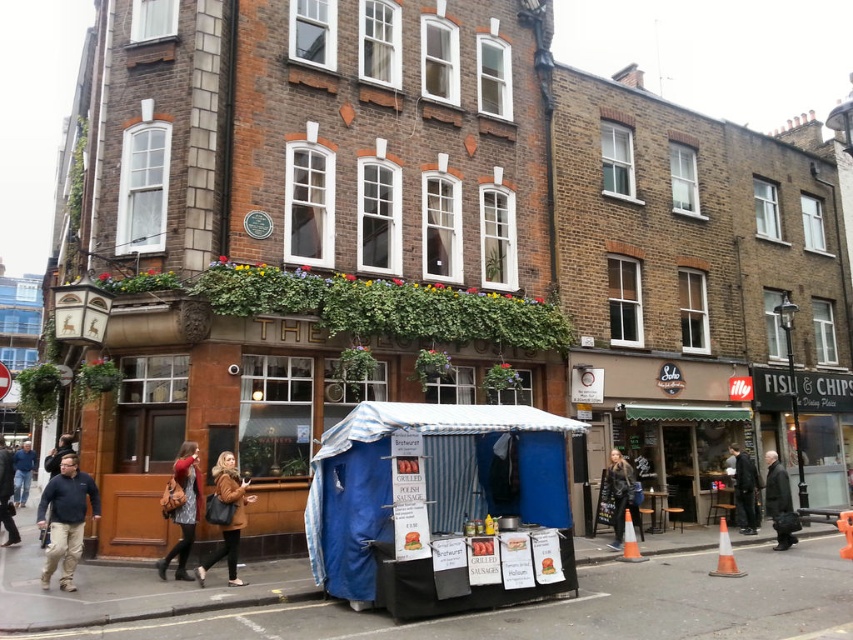
You are a customer waiting in line at the food stall. You notice two items in the scene. One is a brown fuzzy coat at lower center and the other is a dark gray suit at lower right. Which item is closer to your left side?

The brown fuzzy coat at lower center is to the left of the dark gray suit at lower right, so it is closer to your left side.

You are a customer waiting in line at the food stall and notice two coats hanging nearby. The dark blue fleece jacket at lower left and the brown fuzzy coat at lower center. Which coat is positioned higher relative to the other?

The dark blue fleece jacket at lower left is positioned higher than the brown fuzzy coat at lower center.